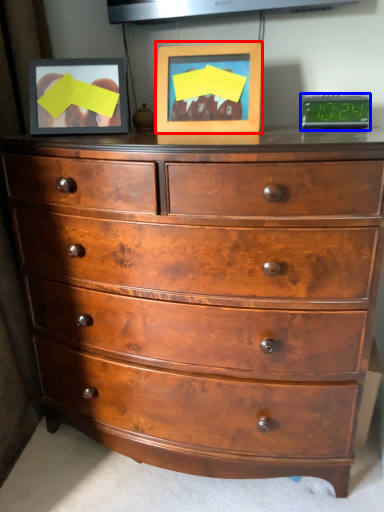
Question: Which object appears closest to the camera in this image, picture frame (highlighted by a red box) or alarm clock (highlighted by a blue box)?

Choices:
 (A) picture frame
 (B) alarm clock

Answer: (A)